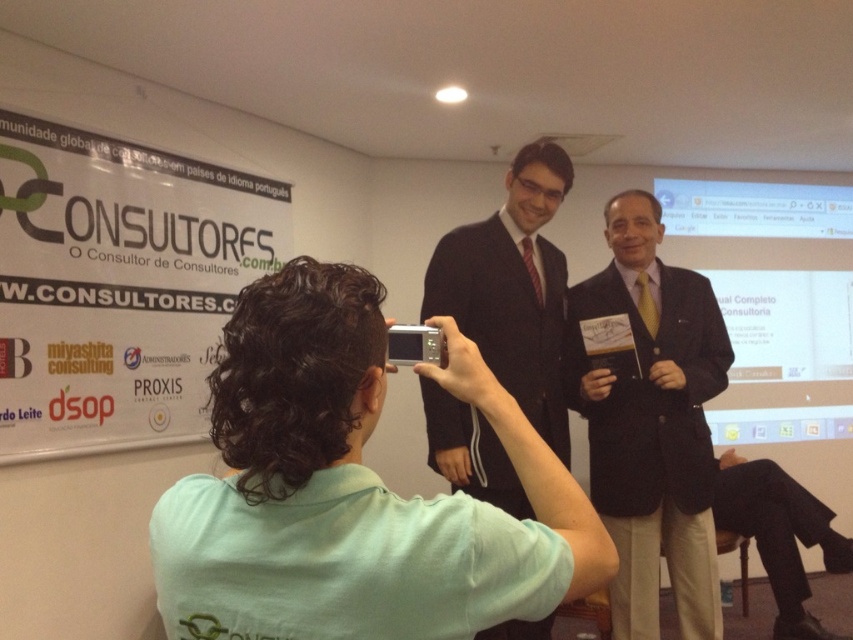
From the picture: You are organizing a professional photoshoot in the conference room and need to ensure that the dark brown suit at center and the dark suit at center are both visible in the frame. Given their sizes, which suit will require more space to be fully captured in the photo?

The dark suit at center requires more space to be fully captured in the photo since it occupies more space than the dark brown suit at center according to the description.

You are standing in the conference room and want to place a small plant between the two points marked as point (554,484) and point (650,632). Since the plant needs to be closer to the front of the room, which point should you position it near?

You should position the plant near point (554,484) because it is in front of point (650,632), making it closer to the front of the room.